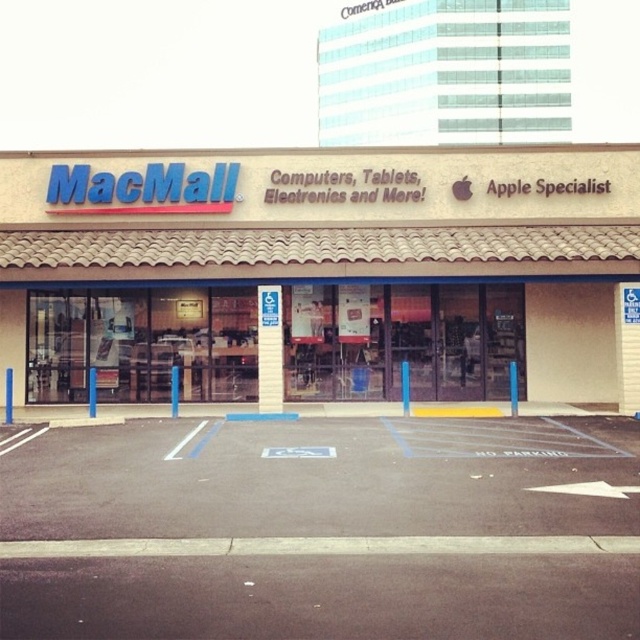
You are standing in front of the MacMall store and see two points on the facade. The first point is at coordinate point (35, 321) and the second is at point (58, 589). Which point is closer to you?

Point (35, 321) is further to the viewer than point (58, 589), so the point closer to you is point (58, 589).

You are standing in front of the MacMall store. There is a point marked at coordinates (x=323, y=273). According to the image, where is this point located?

The point is on beige tile macmall at center.